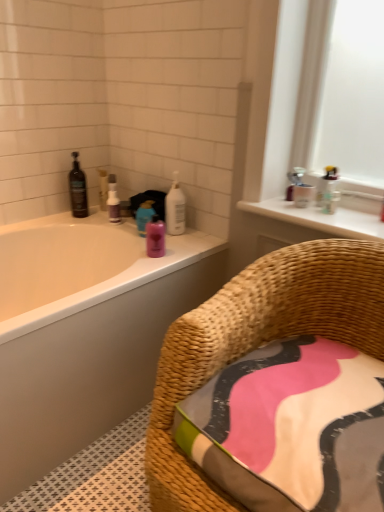
I want to click on purple matte spray bottle at upper left, the second cleaning product positioned from the right, so click(113, 200).

This screenshot has height=512, width=384. What do you see at coordinates (328, 190) in the screenshot?
I see `translucent plastic bottles at upper right, acting as the second toiletry starting from the bottom` at bounding box center [328, 190].

This screenshot has height=512, width=384. Describe the element at coordinates (78, 189) in the screenshot. I see `black glass bottle at upper left` at that location.

In order to face pink glossy bottle at upper center, acting as the 1th toiletry starting from the bottom, should I rotate leftwards or rightwards?

To face it directly, rotate left by 4.879 degrees.

Locate an element on the screen. The image size is (384, 512). woven rattan chair at lower right is located at coordinates (259, 342).

Identify the location of purple matte spray bottle at upper left, the second cleaning product positioned from the right. This screenshot has height=512, width=384. (113, 200).

Is white glossy bottle at upper center, arranged as the 2th cleaning product when viewed from the left, a part of white glossy bathtub at upper left?

No, white glossy bottle at upper center, arranged as the 2th cleaning product when viewed from the left, is not a part of white glossy bathtub at upper left.

Does white glossy bathtub at upper left turn towards white glossy bottle at upper center, the 1th cleaning product when ordered from right to left?

No.

You are a GUI agent. You are given a task and a screenshot of the screen. Output one action in this format:
    pyautogui.click(x=<x>, y=<y>)
    Task: Click on the bathtub below the white glossy bottle at upper center, the 1th cleaning product when ordered from right to left (from a real-world perspective)
    This screenshot has height=512, width=384.
    Given the screenshot: What is the action you would take?
    pyautogui.click(x=85, y=330)

Which of these two, white glossy bathtub at upper left or white glossy bottle at upper center, the 1th cleaning product when ordered from right to left, is bigger?

Bigger between the two is white glossy bathtub at upper left.

Relative to black glass bottle at upper left, is white glossy bathtub at upper left in front or behind?

In the image, white glossy bathtub at upper left appears in front of black glass bottle at upper left.

Looking at this image, considering the sizes of objects white glossy bathtub at upper left and black glass bottle at upper left in the image provided, who is wider, white glossy bathtub at upper left or black glass bottle at upper left?

With larger width is white glossy bathtub at upper left.

This screenshot has width=384, height=512. Find the location of `wine bottle above the white glossy bathtub at upper left (from a real-world perspective)`. wine bottle above the white glossy bathtub at upper left (from a real-world perspective) is located at coordinates (78, 189).

Can you confirm if white glossy bathtub at upper left is bigger than black glass bottle at upper left?

Yes, white glossy bathtub at upper left is bigger than black glass bottle at upper left.

Identify the location of window sill directly beneath the translucent plastic bottles at upper right, acting as the second toiletry starting from the bottom (from a real-world perspective). This screenshot has width=384, height=512. (319, 218).

Is translucent plastic bottles at upper right, arranged as the 2th toiletry when viewed from the left, taller than white glossy window sill at upper right?

Indeed, translucent plastic bottles at upper right, arranged as the 2th toiletry when viewed from the left, has a greater height compared to white glossy window sill at upper right.

Is translucent plastic bottles at upper right, the 1th toiletry when ordered from top to bottom, located outside white glossy window sill at upper right?

Indeed, translucent plastic bottles at upper right, the 1th toiletry when ordered from top to bottom, is completely outside white glossy window sill at upper right.

From the image's perspective, who appears lower, translucent plastic bottles at upper right, acting as the second toiletry starting from the bottom, or white glossy window sill at upper right?

white glossy window sill at upper right is shown below in the image.

Is point (184, 219) behind point (331, 190)?

Yes, point (184, 219) is behind point (331, 190).

Which of these two, white glossy bottle at upper center, arranged as the 2th cleaning product when viewed from the left, or translucent plastic bottles at upper right, the first toiletry when ordered from right to left, is smaller?

With smaller size is translucent plastic bottles at upper right, the first toiletry when ordered from right to left.

Does white glossy bottle at upper center, arranged as the 2th cleaning product when viewed from the left, appear on the left side of translucent plastic bottles at upper right, the 1th toiletry when ordered from top to bottom?

Correct, you'll find white glossy bottle at upper center, arranged as the 2th cleaning product when viewed from the left, to the left of translucent plastic bottles at upper right, the 1th toiletry when ordered from top to bottom.

Who is taller, white glossy bottle at upper center, arranged as the 2th cleaning product when viewed from the left, or translucent plastic bottles at upper right, the 1th toiletry when ordered from top to bottom?

With more height is white glossy bottle at upper center, arranged as the 2th cleaning product when viewed from the left.

Between white glossy bottle at upper center, the 1th cleaning product when ordered from right to left, and white glossy bathtub at upper left, which one has more height?

white glossy bathtub at upper left is taller.

Could you measure the distance between white glossy bottle at upper center, the 1th cleaning product when ordered from right to left, and white glossy bathtub at upper left?

They are 20.00 inches apart.

Which is more to the right, white glossy bottle at upper center, arranged as the 2th cleaning product when viewed from the left, or white glossy bathtub at upper left?

Positioned to the right is white glossy bottle at upper center, arranged as the 2th cleaning product when viewed from the left.

Considering the sizes of objects white glossy bottle at upper center, the 1th cleaning product when ordered from right to left, and white glossy bathtub at upper left in the image provided, who is bigger, white glossy bottle at upper center, the 1th cleaning product when ordered from right to left, or white glossy bathtub at upper left?

white glossy bathtub at upper left.

Which object is closer to the camera, white glossy window sill at upper right or woven rattan chair at lower right?

woven rattan chair at lower right.

Can you tell me how much white glossy window sill at upper right and woven rattan chair at lower right differ in facing direction?

They differ by 0.0155 degrees in their facing directions.

Is white glossy window sill at upper right bigger or smaller than woven rattan chair at lower right?

Clearly, white glossy window sill at upper right is smaller in size than woven rattan chair at lower right.

Between white glossy window sill at upper right and woven rattan chair at lower right, which one appears on the left side from the viewer's perspective?

woven rattan chair at lower right is more to the left.

Considering the positions of points (79, 387) and (115, 184), is point (79, 387) farther from camera compared to point (115, 184)?

No, it is not.

Could you tell me if white glossy bathtub at upper left is facing purple matte spray bottle at upper left, which ranks as the 1th cleaning product in left-to-right order?

No, white glossy bathtub at upper left is not facing towards purple matte spray bottle at upper left, which ranks as the 1th cleaning product in left-to-right order.

From a real-world perspective, is white glossy bathtub at upper left on purple matte spray bottle at upper left, the second cleaning product positioned from the right?

No, from a real-world perspective, white glossy bathtub at upper left is not above purple matte spray bottle at upper left, the second cleaning product positioned from the right.

The image size is (384, 512). What are the coordinates of `bathtub that appears below the white glossy bottle at upper center, arranged as the 2th cleaning product when viewed from the left (from the image's perspective)` in the screenshot? It's located at (85, 330).

You are a GUI agent. You are given a task and a screenshot of the screen. Output one action in this format:
    pyautogui.click(x=<x>, y=<y>)
    Task: Click on the wine bottle located above the white glossy bathtub at upper left (from the image's perspective)
    The image size is (384, 512).
    Given the screenshot: What is the action you would take?
    pyautogui.click(x=78, y=189)

Estimate the real-world distances between objects in this image. Which object is further from pink glossy bottle at upper center, which is the first toiletry in left-to-right order, white glossy bathtub at upper left or white glossy window sill at upper right?

Among the two, white glossy window sill at upper right is located further to pink glossy bottle at upper center, which is the first toiletry in left-to-right order.

When comparing their distances from translucent plastic bottles at upper right, acting as the second toiletry starting from the bottom, does pink glossy bottle at upper center, acting as the 1th toiletry starting from the bottom, or woven rattan chair at lower right seem closer?

The object closer to translucent plastic bottles at upper right, acting as the second toiletry starting from the bottom, is pink glossy bottle at upper center, acting as the 1th toiletry starting from the bottom.

When comparing their distances from purple matte spray bottle at upper left, the second cleaning product positioned from the right, does translucent plastic bottles at upper right, the first toiletry when ordered from right to left, or pink glossy bottle at upper center, which is the first toiletry in left-to-right order, seem further?

Among the two, translucent plastic bottles at upper right, the first toiletry when ordered from right to left, is located further to purple matte spray bottle at upper left, the second cleaning product positioned from the right.

When comparing their distances from white glossy window sill at upper right, does white glossy bathtub at upper left or purple matte spray bottle at upper left, which ranks as the 1th cleaning product in left-to-right order, seem closer?

white glossy bathtub at upper left is positioned closer to the anchor white glossy window sill at upper right.

From the image, which object appears to be farther from woven rattan chair at lower right, pink glossy bottle at upper center, acting as the 2th toiletry starting from the top, or white glossy window sill at upper right?

Based on the image, pink glossy bottle at upper center, acting as the 2th toiletry starting from the top, appears to be further to woven rattan chair at lower right.

Which object lies further to the anchor point white glossy bottle at upper center, arranged as the 2th cleaning product when viewed from the left, white glossy window sill at upper right or translucent plastic bottles at upper right, the first toiletry when ordered from right to left?

The object further to white glossy bottle at upper center, arranged as the 2th cleaning product when viewed from the left, is translucent plastic bottles at upper right, the first toiletry when ordered from right to left.

Estimate the real-world distances between objects in this image. Which object is closer to purple matte spray bottle at upper left, the second cleaning product positioned from the right, woven rattan chair at lower right or white glossy bottle at upper center, the 1th cleaning product when ordered from right to left?

white glossy bottle at upper center, the 1th cleaning product when ordered from right to left, is positioned closer to the anchor purple matte spray bottle at upper left, the second cleaning product positioned from the right.

In the scene shown: Which object lies further to the anchor point black glass bottle at upper left, pink glossy bottle at upper center, acting as the 2th toiletry starting from the top, or white glossy bathtub at upper left?

white glossy bathtub at upper left is positioned further to the anchor black glass bottle at upper left.

At what (x,y) coordinates should I click in order to perform the action: click on bathtub located between woven rattan chair at lower right and white glossy bottle at upper center, the 1th cleaning product when ordered from right to left, in the depth direction. Please return your answer as a coordinate pair (x, y). This screenshot has width=384, height=512. Looking at the image, I should click on (85, 330).

Where is `cleaning product between pink glossy bottle at upper center, acting as the 1th toiletry starting from the bottom, and white glossy window sill at upper right`? cleaning product between pink glossy bottle at upper center, acting as the 1th toiletry starting from the bottom, and white glossy window sill at upper right is located at coordinates [175, 208].

The image size is (384, 512). In order to click on toiletry between white glossy bathtub at upper left and white glossy window sill at upper right in the horizontal direction in this screenshot , I will do `click(155, 237)`.

In order to click on toiletry between woven rattan chair at lower right and translucent plastic bottles at upper right, the 1th toiletry when ordered from top to bottom, along the z-axis in this screenshot , I will do `click(155, 237)`.